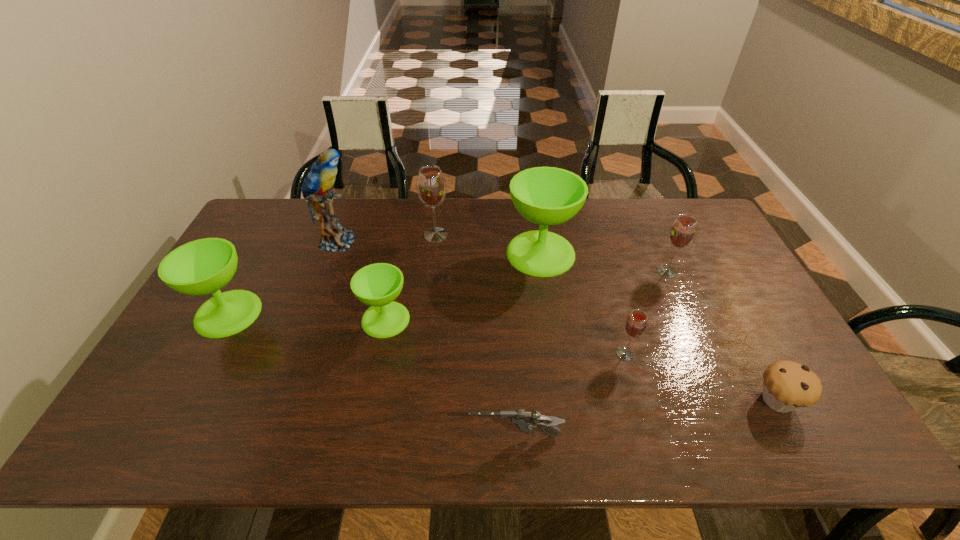
This screenshot has width=960, height=540. I want to click on vacant area located 0.080m on the right of the leftmost wineglass, so click(x=288, y=313).

The height and width of the screenshot is (540, 960). What are the coordinates of `vacant space situated 0.290m on the left of the nearest red wineglass` in the screenshot? It's located at (504, 354).

Locate an element on the screen. This screenshot has width=960, height=540. vacant space located on the right of the smallest green wineglass is located at coordinates (540, 319).

At what (x,y) coordinates should I click in order to perform the action: click on free space located 0.200m on the left of the second nearest object. Please return your answer as a coordinate pair (x, y). This screenshot has width=960, height=540. Looking at the image, I should click on (670, 400).

The image size is (960, 540). I want to click on free space located at the barrel of the gun, so click(x=293, y=436).

Identify the location of vacant space located 0.280m at the barrel of the gun. The width and height of the screenshot is (960, 540). (346, 436).

The height and width of the screenshot is (540, 960). I want to click on free spot located at the barrel of the gun, so click(x=403, y=436).

Where is `parrot located in the far edge section of the desktop`? parrot located in the far edge section of the desktop is located at coordinates (316, 186).

Where is `muffin located in the near edge section of the desktop`? This screenshot has width=960, height=540. muffin located in the near edge section of the desktop is located at coordinates (787, 386).

This screenshot has width=960, height=540. In order to click on gun located in the near edge section of the desktop in this screenshot , I will do `click(524, 421)`.